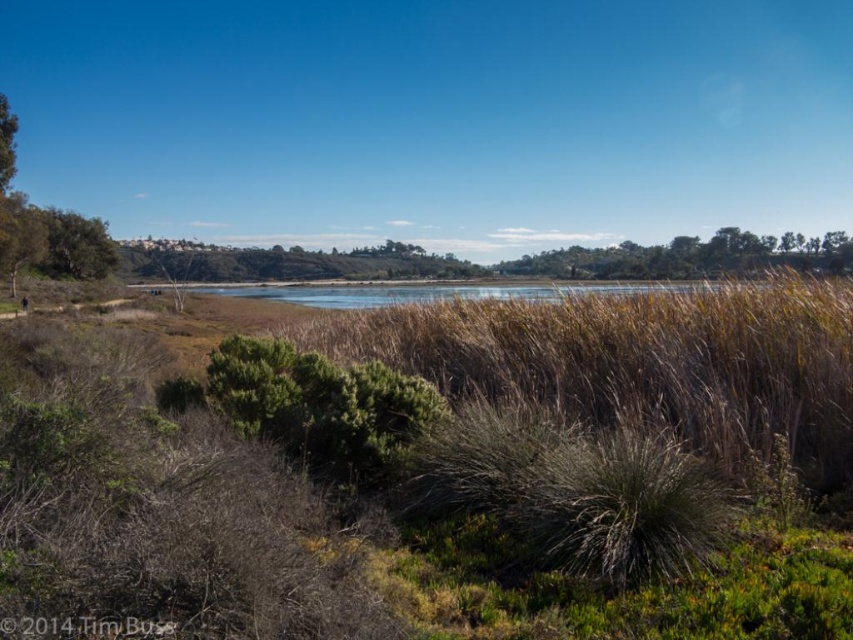
You are a hiker trying to cross the lagoon. You see the brown grass at center and the green leafy tree at left. Which object would be more suitable to use as a marker to navigate your path?

The green leafy tree at left would be more suitable as a marker because it is thicker than the brown grass at center, making it more visible from a distance.